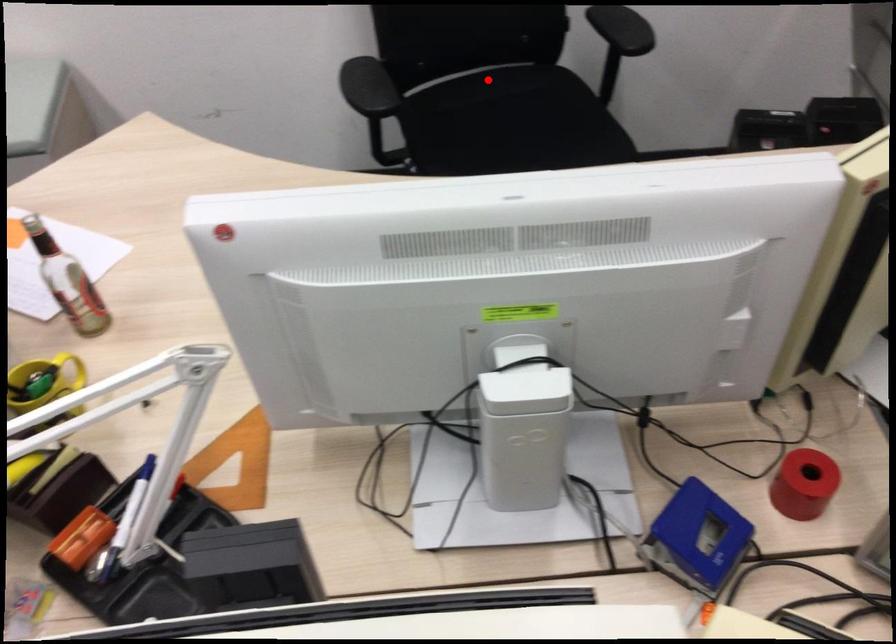
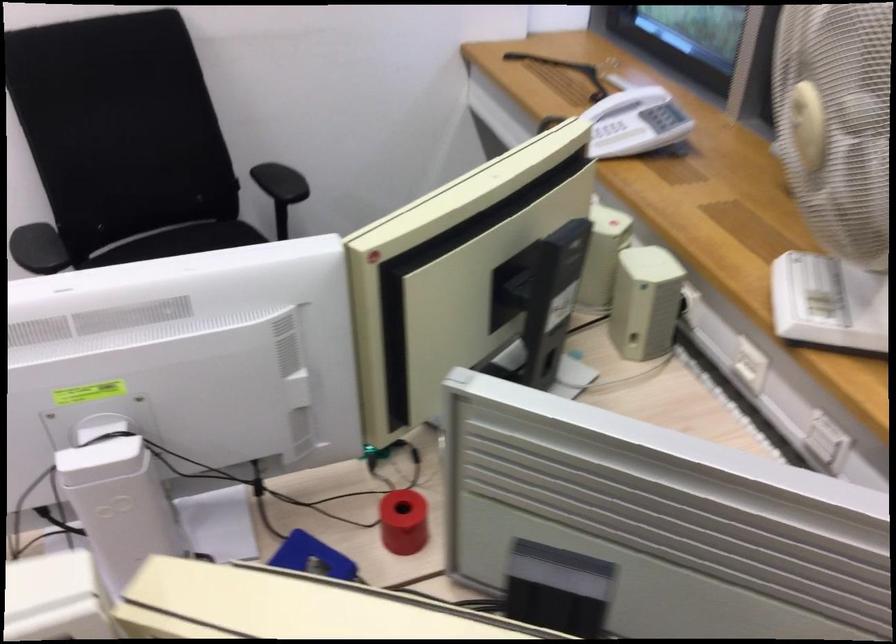
Find the pixel in the second image that matches the highlighted location in the first image.

(179, 240)